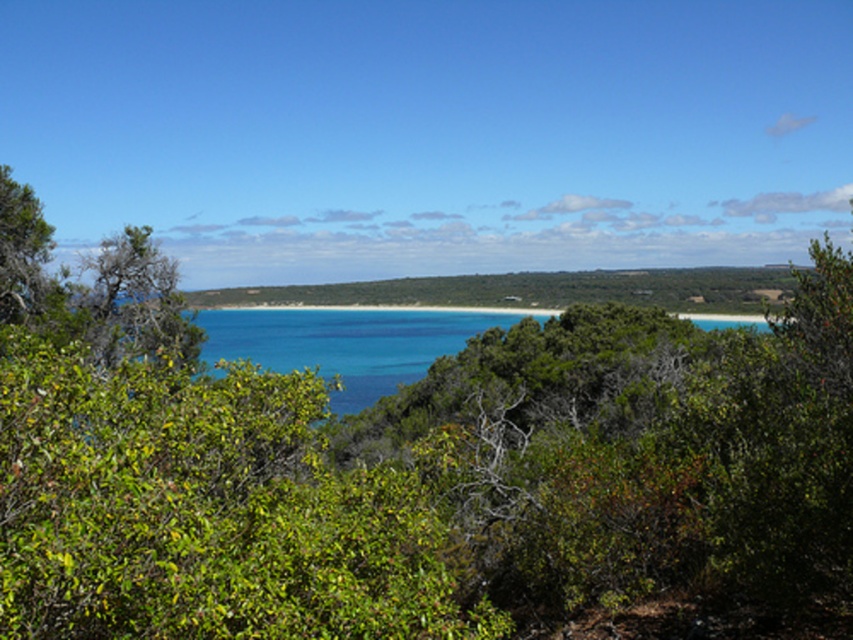
You are standing at the edge of the beach looking out to the ocean. There are two points marked on the image, one at coordinates point (x=259, y=506) and another at point (x=207, y=328). Which point is physically closer to you?

Point (x=259, y=506) is closer to the camera than point (x=207, y=328), so the point at coordinates point (x=259, y=506) is physically closer to you.

You are standing on the beach and see the green leafy bush at center and the blue water at center. Which object is closer to you?

The green leafy bush at center is closer to you because it is positioned over the blue water at center, indicating it is in front of the water.